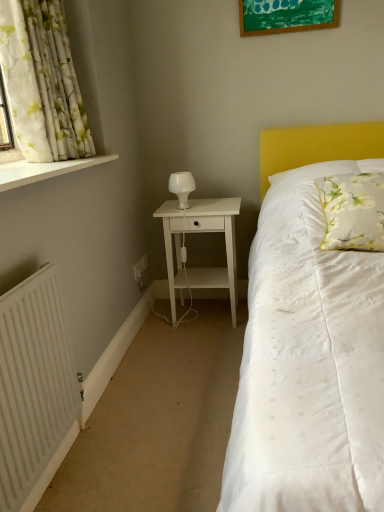
Question: Is white floral fabric pillow at upper right taller or shorter than white glossy window sill at upper left?

Choices:
 (A) short
 (B) tall

Answer: (B)

Question: From a real-world perspective, relative to white glossy window sill at upper left, is white floral fabric pillow at upper right vertically above or below?

Choices:
 (A) below
 (B) above

Answer: (A)

Question: Estimate the real-world distances between objects in this image. Which object is farther from the white ribbed radiator at lower left?

Choices:
 (A) white matte nightstand at center
 (B) green matte picture frame at upper center
 (C) white frosted glass table lamp at center
 (D) white plastic electric outlet at lower left, which is counted as the 2th electric outlet, starting from the back
 (E) white floral fabric pillow at upper right

Answer: (B)

Question: Which object is positioned closest to the white frosted glass table lamp at center?

Choices:
 (A) white floral fabric curtain at left
 (B) white plastic electric outlet at lower left, positioned as the second electric outlet in front-to-back order
 (C) white glossy window sill at upper left
 (D) white matte nightstand at center
 (E) green matte picture frame at upper center

Answer: (D)